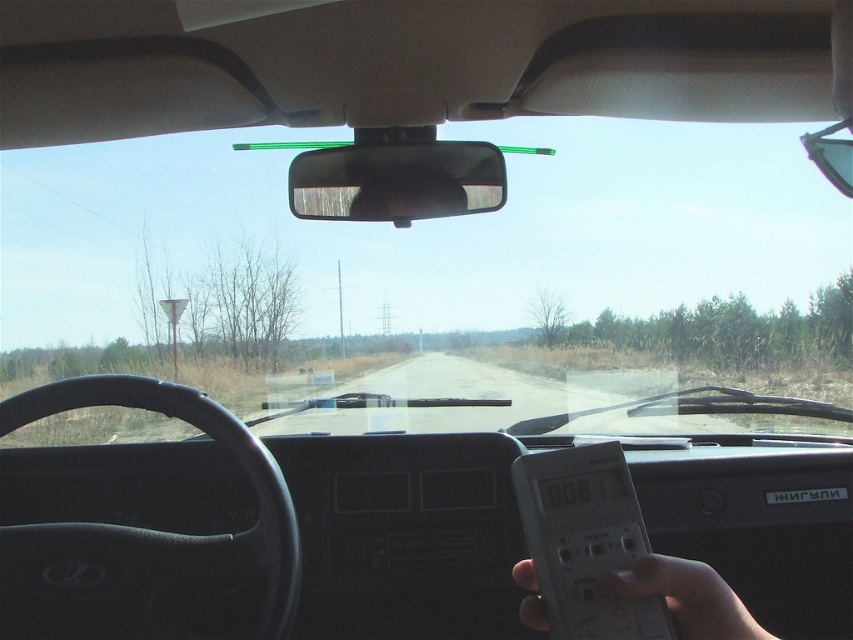
You are driving a car and need to reach the white plastic remote at lower right from the black glossy view mirror at center. Given that the distance between them is 3.61 meters, can you estimate how far you need to stretch your hand to reach it?

The black glossy view mirror at center is 3.61 meters away from the white plastic remote at lower right, so you need to stretch your hand approximately 3.61 meters to reach it.

You are driving a car and need to reach both the black glossy view mirror at center and the white plastic remote at lower right. Which object is closer to your hand when you are sitting in the driver seat?

The black glossy view mirror at center is closer to your hand because it is further to the viewer than the white plastic remote at lower right, meaning it is positioned nearer to the driver in the vehicle.